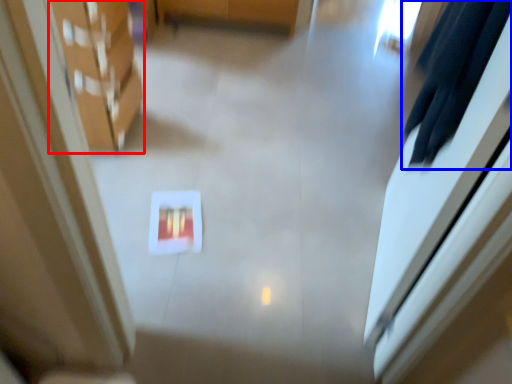
Question: Which point is further to the camera, furniture (highlighted by a red box) or robe (highlighted by a blue box)?

Choices:
 (A) furniture
 (B) robe

Answer: (A)